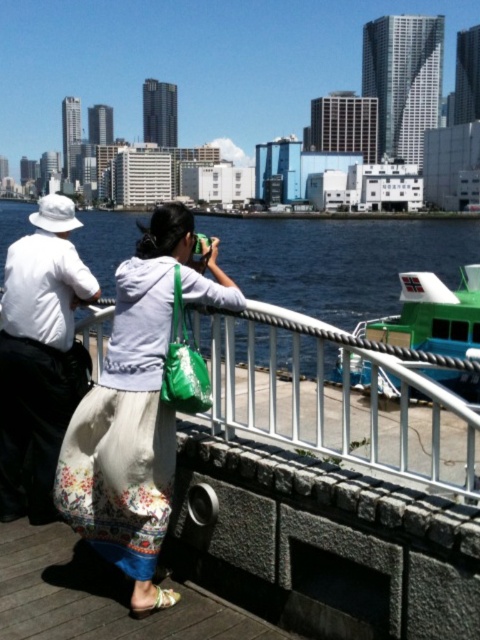
Image resolution: width=480 pixels, height=640 pixels. I want to click on blue water at center, so click(338, 260).

Locate an element on the screen. blue water at center is located at coordinates (338, 260).

Is point (62, 369) positioned after point (460, 374)?

No, it is in front of (460, 374).

Can you confirm if white matte hat at upper left is positioned to the left of green plastic boat at right?

Correct, you'll find white matte hat at upper left to the left of green plastic boat at right.

Who is more forward, (1, 385) or (466, 298)?

Positioned in front is point (1, 385).

Locate an element on the screen. Image resolution: width=480 pixels, height=640 pixels. white matte hat at upper left is located at coordinates (38, 355).

Between blue water at center and green plastic boat at right, which one has more height?

Standing taller between the two is blue water at center.

Is point (79, 236) positioned after point (466, 381)?

Yes, point (79, 236) is behind point (466, 381).

Find the location of a particular element. The image size is (480, 640). blue water at center is located at coordinates (338, 260).